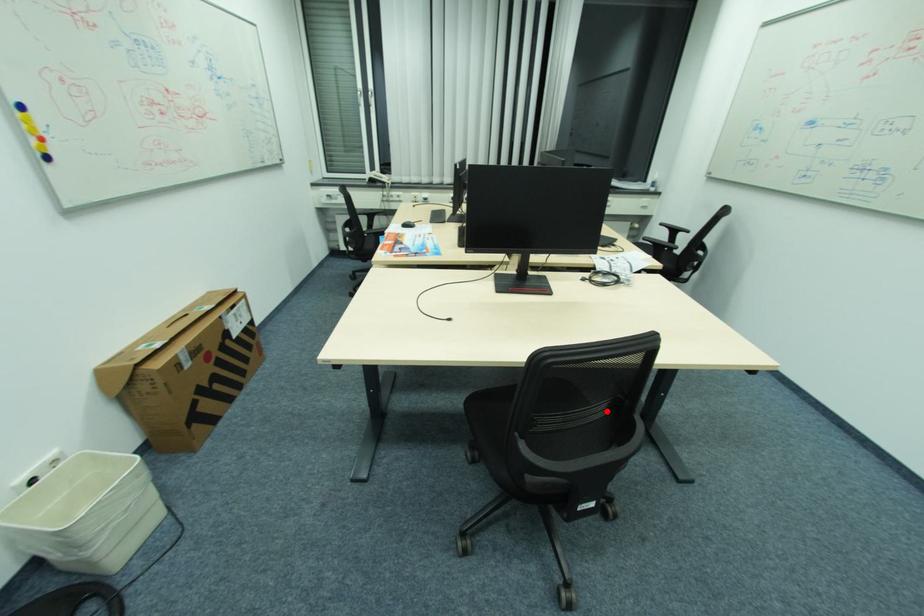
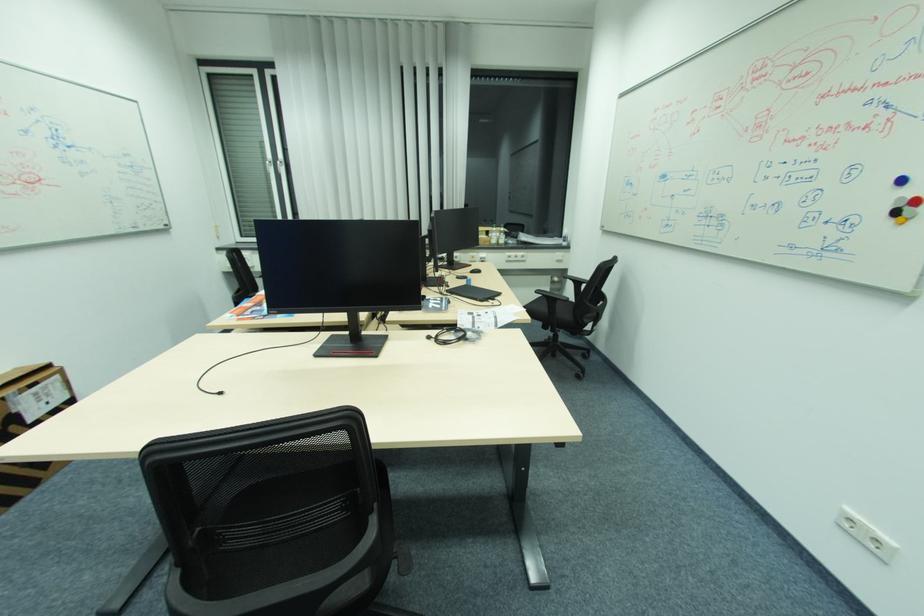
Question: I am providing you with two images of the same scene from different viewpoints. A red point is marked on the first image. At the location where the point appears in image 1, is it still visible in image 2?

Choices:
 (A) Yes
 (B) No

Answer: (A)